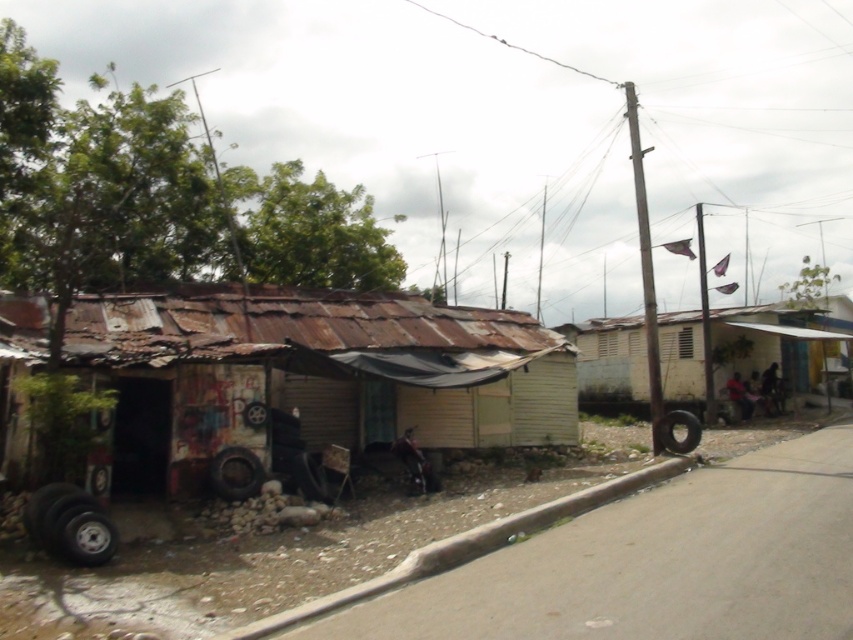
Is point (798, 310) positioned in front of point (413, 572)?

That is False.

Is white corrugated metal hut at center-right thinner than smooth concrete curb at lower center?

In fact, white corrugated metal hut at center-right might be wider than smooth concrete curb at lower center.

Does point (772, 337) come closer to viewer compared to point (440, 540)?

That is False.

This screenshot has width=853, height=640. I want to click on white corrugated metal hut at center-right, so click(741, 348).

Does rusty tin hut at left have a greater height compared to white corrugated metal hut at center-right?

In fact, rusty tin hut at left may be shorter than white corrugated metal hut at center-right.

Can you confirm if rusty tin hut at left is bigger than white corrugated metal hut at center-right?

No, rusty tin hut at left is not bigger than white corrugated metal hut at center-right.

Is point (245, 340) in front of point (751, 369)?

Yes, point (245, 340) is closer to viewer.

The width and height of the screenshot is (853, 640). I want to click on rusty tin hut at left, so click(x=306, y=380).

Which of these two, rusty tin hut at left or smooth concrete curb at lower center, stands shorter?

smooth concrete curb at lower center

Can you confirm if rusty tin hut at left is positioned to the left of smooth concrete curb at lower center?

Yes, rusty tin hut at left is to the left of smooth concrete curb at lower center.

Does point (160, 406) lie behind point (483, 536)?

Yes.

The image size is (853, 640). Identify the location of rusty tin hut at left. (306, 380).